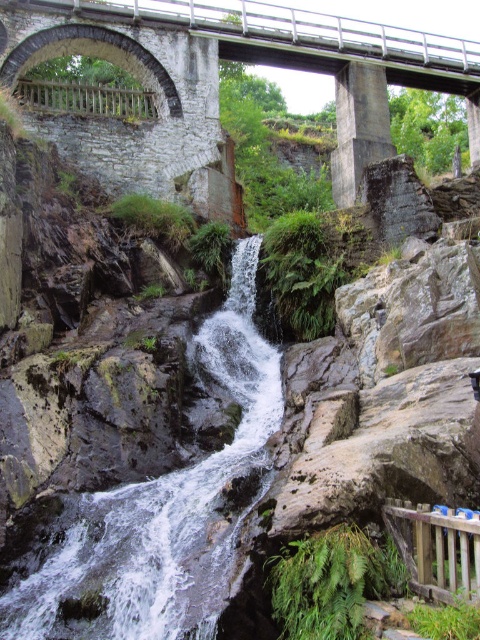
You are a hiker who wants to cross the stone bridge at upper center to get to the other side. You notice there is white frothy water at center below it. Can you safely walk across the bridge?

The white frothy water at center is narrower than the stone bridge at upper center, so the bridge should be stable enough to walk across safely.

You are a hiker planning to cross the stone bridge at upper center. You notice the white frothy water at center nearby. Which direction should you avoid to stay away from the water?

You should avoid going to the left side of the stone bridge at upper center because the white frothy water at center is positioned there.